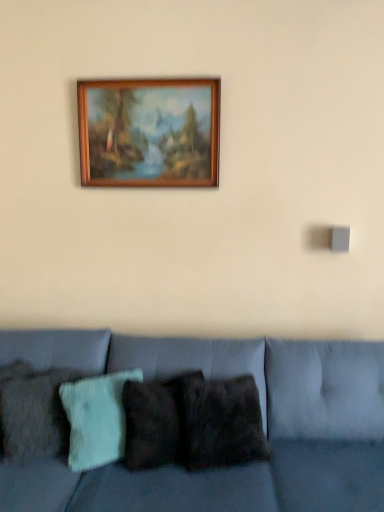
What are the coordinates of `free spot above wooden picture frame at upper center (from a real-world perspective)` in the screenshot? It's located at (149, 78).